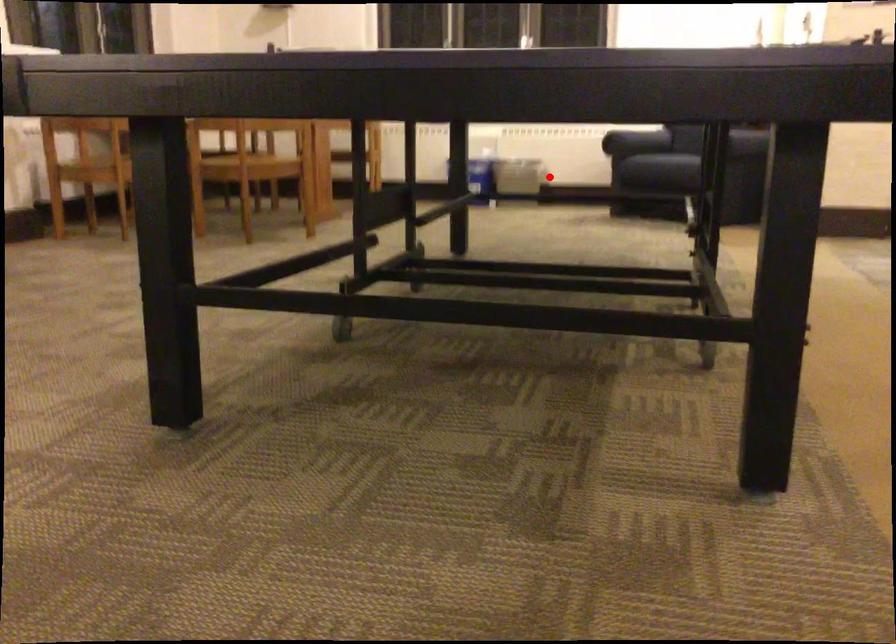
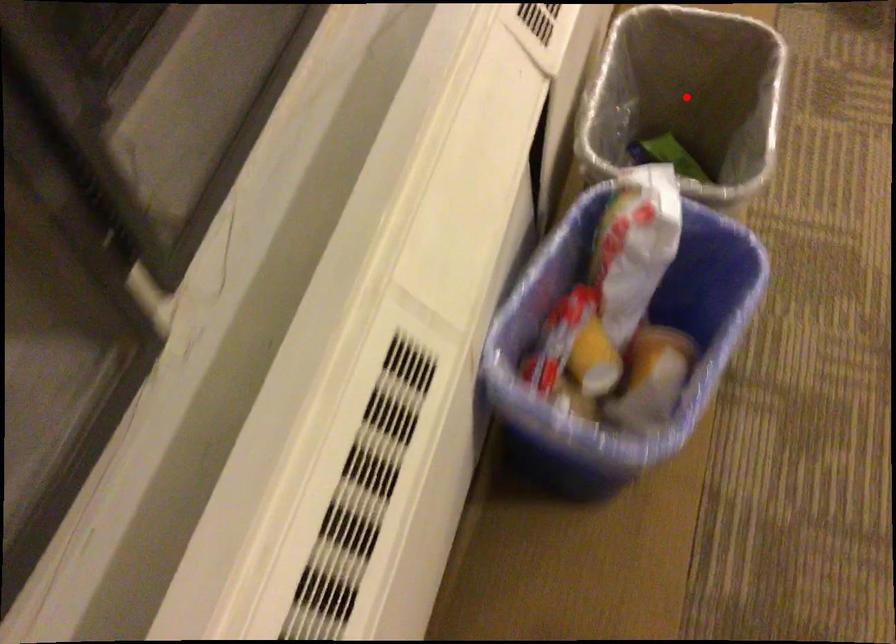
I am providing you with two images of the same scene from different viewpoints. A red point is marked on the first image and another point is marked on the second image. Are the points marked in image1 and image2 representing the same 3D position?

Yes